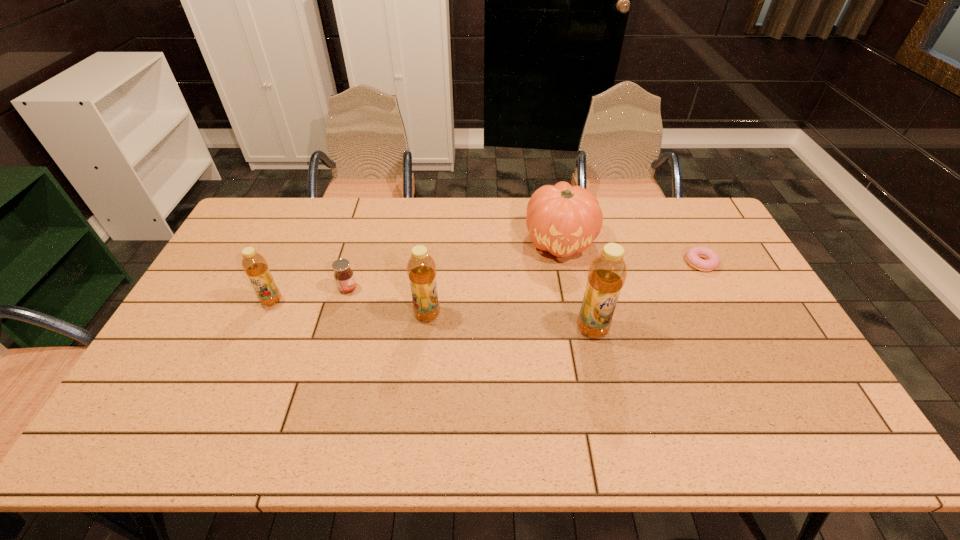
In the image, there is a desktop. Where is `free space at the near edge`? Image resolution: width=960 pixels, height=540 pixels. free space at the near edge is located at coordinates (425, 386).

In the image, there is a desktop. Where is `vacant space at the left edge`? The image size is (960, 540). vacant space at the left edge is located at coordinates (255, 244).

In the image, there is a desktop. At what (x,y) coordinates should I click in order to perform the action: click on vacant space at the right edge. Please return your answer as a coordinate pair (x, y). Looking at the image, I should click on (716, 313).

Locate an element on the screen. free space at the far left corner is located at coordinates (246, 234).

Where is `unoccupied position between the fourth object from right to left and the leftmost object`? The image size is (960, 540). unoccupied position between the fourth object from right to left and the leftmost object is located at coordinates (349, 307).

Find the location of a particular element. The height and width of the screenshot is (540, 960). free space between the fifth shortest object and the rightmost bottle is located at coordinates (510, 321).

Where is `free spot between the tallest bottle and the pumpkin`? free spot between the tallest bottle and the pumpkin is located at coordinates (576, 285).

Find the location of `vacant area that lies between the leftmost object and the fifth object from right to left`. vacant area that lies between the leftmost object and the fifth object from right to left is located at coordinates (310, 294).

Locate an element on the screen. This screenshot has height=540, width=960. free spot between the doughnut and the second tallest object is located at coordinates (564, 288).

Locate an element on the screen. This screenshot has width=960, height=540. vacant space in between the doughnut and the fourth object from right to left is located at coordinates (564, 288).